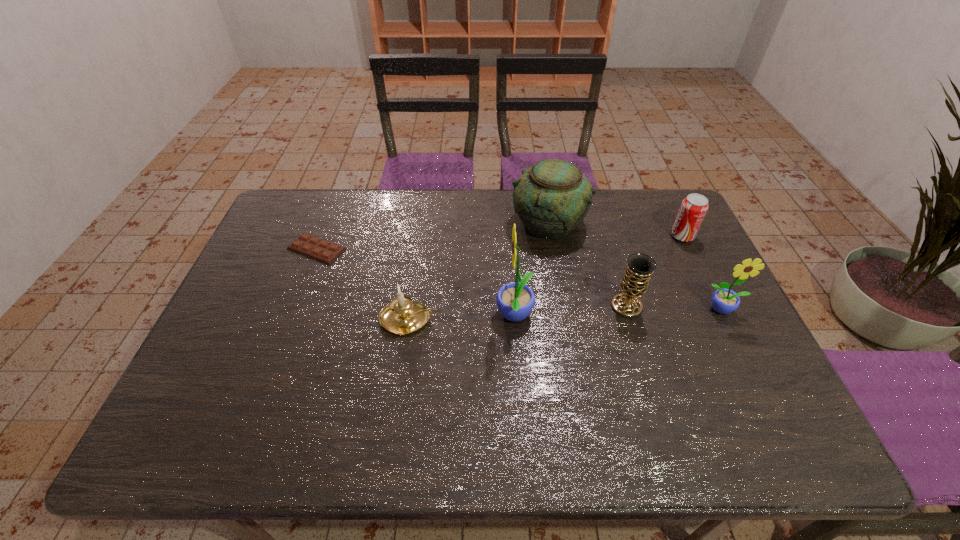
At what (x,y) coordinates should I click in order to perform the action: click on pottery that is at the far edge. Please return your answer as a coordinate pair (x, y). The image size is (960, 540). Looking at the image, I should click on (552, 198).

Where is `soda can positioned at the far edge`? This screenshot has height=540, width=960. soda can positioned at the far edge is located at coordinates (693, 209).

Identify the location of object at the left edge. (310, 246).

At what (x,y) coordinates should I click in order to perform the action: click on sunflower present at the right edge. Please return your answer as a coordinate pair (x, y). This screenshot has height=540, width=960. Looking at the image, I should click on (724, 301).

Find the location of `soda can situated at the right edge`. soda can situated at the right edge is located at coordinates (693, 209).

The width and height of the screenshot is (960, 540). What are the coordinates of `object that is at the far right corner` in the screenshot? It's located at (693, 209).

This screenshot has height=540, width=960. Identify the location of free space at the far edge. (449, 225).

What are the coordinates of `free location at the far left corner of the desktop` in the screenshot? It's located at (276, 224).

Identify the location of vacant space at the far right corner. (626, 191).

Find the location of `vacant space in between the chocolate bar and the chalice`. vacant space in between the chocolate bar and the chalice is located at coordinates (471, 278).